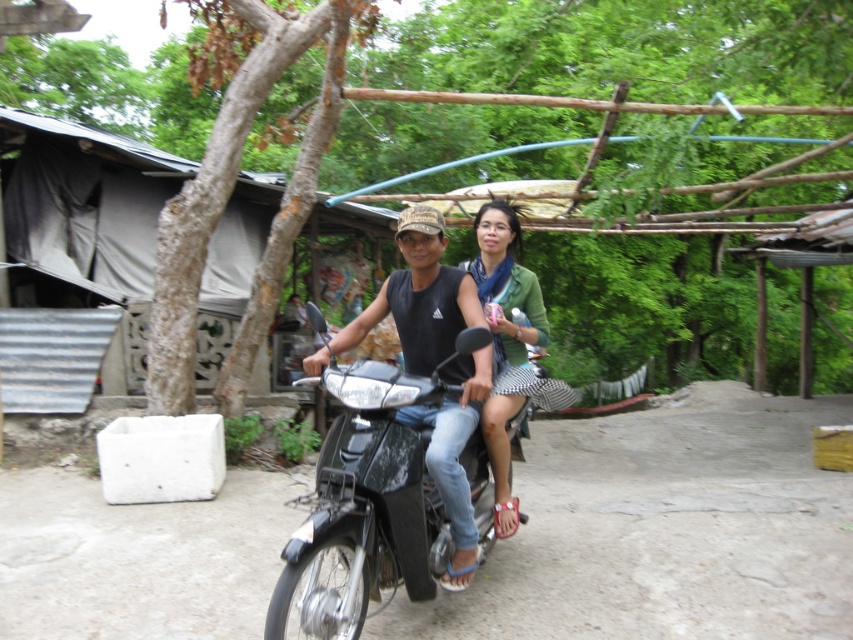
In the scene shown: You are standing at the center of the image and want to reach the point marked by the coordinates point (415, 300). What object must you avoid walking through to reach it?

The point (415, 300) is on the matte black motorcycle at center, so you must avoid walking through the matte black motorcycle at center to reach it.

You are a delivery person who needs to pass through a narrow alley that is only 1.2 meters wide. You are currently riding the shiny black motorcycle at center with a passenger wearing the green matte shirt at center. Can you safely navigate the alley without hitting the walls on either side?

The shiny black motorcycle at center might be wider than green matte shirt at center, so there is a possibility that the motorcycle is wider than 1.2 meters. Therefore, it might not be safe to navigate the alley without hitting the walls on either side.

You are standing in the scene and see two points marked on the ground. The first point is at coordinates point [364,586] and the second point is at point [329,353]. Which point is closer to you?

Point [364,586] is closer to the viewer than point [329,353].